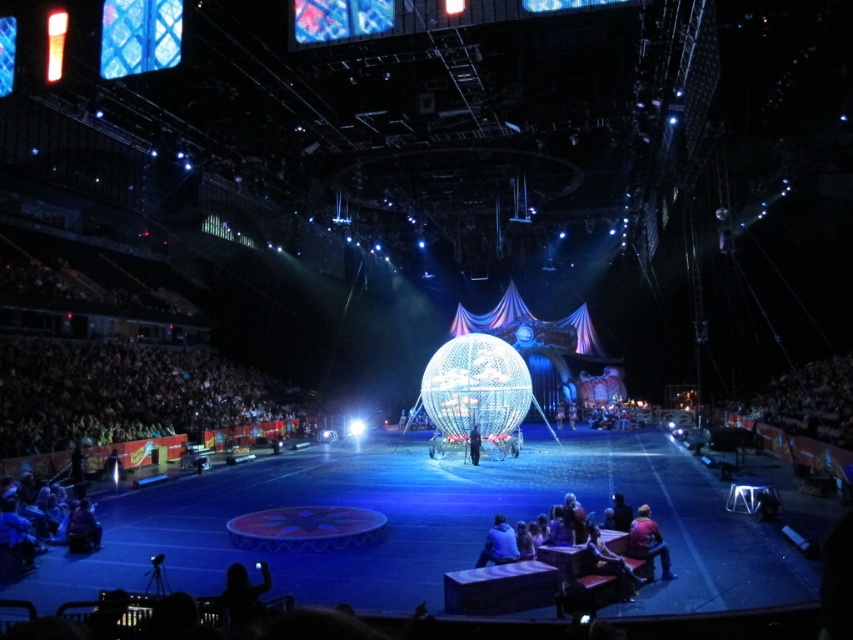
Is point (86, 518) less distant than point (469, 429)?

Yes.

Does blue denim jeans at lower left have a smaller size compared to dark blue fabric person at center?

No.

Who is more forward, (x=56, y=534) or (x=473, y=426)?

Positioned in front is point (x=56, y=534).

Identify the location of blue denim jeans at lower left. (39, 529).

Can you confirm if red fabric jacket at lower right is shorter than dark blue fabric person at center?

Indeed, red fabric jacket at lower right has a lesser height compared to dark blue fabric person at center.

At what (x,y) coordinates should I click in order to perform the action: click on red fabric jacket at lower right. Please return your answer as a coordinate pair (x, y). The width and height of the screenshot is (853, 640). Looking at the image, I should click on (648, 541).

Which of these two, dark blue fabric at lower right or red fabric jacket at lower right, stands shorter?

With less height is red fabric jacket at lower right.

Who is more distant from viewer, (641, 560) or (653, 547)?

The point (653, 547) is more distant.

Is point (616, 592) positioned after point (648, 563)?

That is False.

Identify the location of dark blue fabric at lower right. (604, 548).